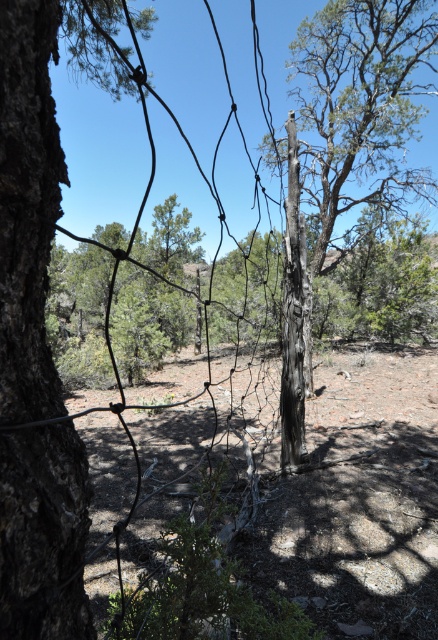
You are standing in the forest scene and want to place a small marker at both the point at [396,554] and the point at [373,8]. Which point will require you to walk further into the forest to reach?

The point at [373,8] will require walking further into the forest because it is farther from the viewer compared to the point at [396,554].

You are a park ranger who needs to locate the charred wood tree at center in the forest. According to the coordinates provided, where exactly should you look to find it?

The charred wood tree at center is located at coordinates point (360, 104).

You are a park ranger assessing fire damage in the forest. You notice the dark brown bark tree trunk at left and the charred wood tree at center. Which tree has a smaller circumference?

The dark brown bark tree trunk at left has a smaller circumference than the charred wood tree at center.